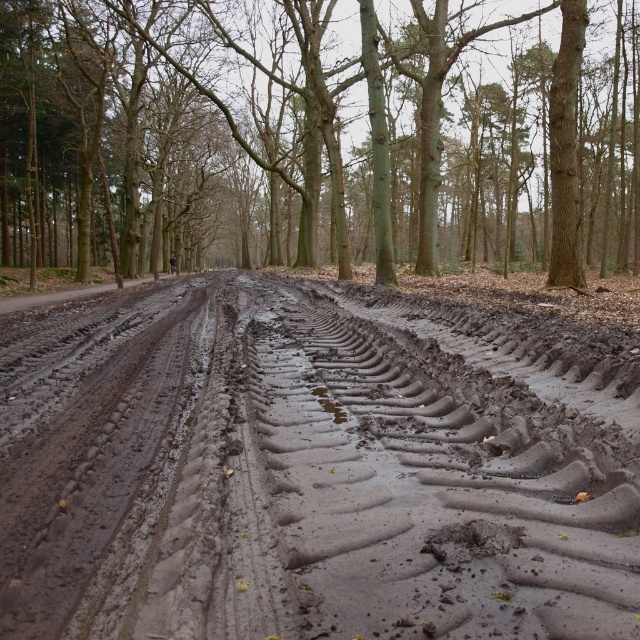
Question: Is muddy rubber tire tracks at center below brown smooth tree at center?

Choices:
 (A) yes
 (B) no

Answer: (A)

Question: Which point is farther from the camera taking this photo?

Choices:
 (A) (513, 364)
 (B) (340, 173)

Answer: (B)

Question: Is muddy rubber tire tracks at center above brown smooth tree at center?

Choices:
 (A) yes
 (B) no

Answer: (B)

Question: Is muddy rubber tire tracks at center further to the viewer compared to brown smooth tree at center?

Choices:
 (A) no
 (B) yes

Answer: (A)